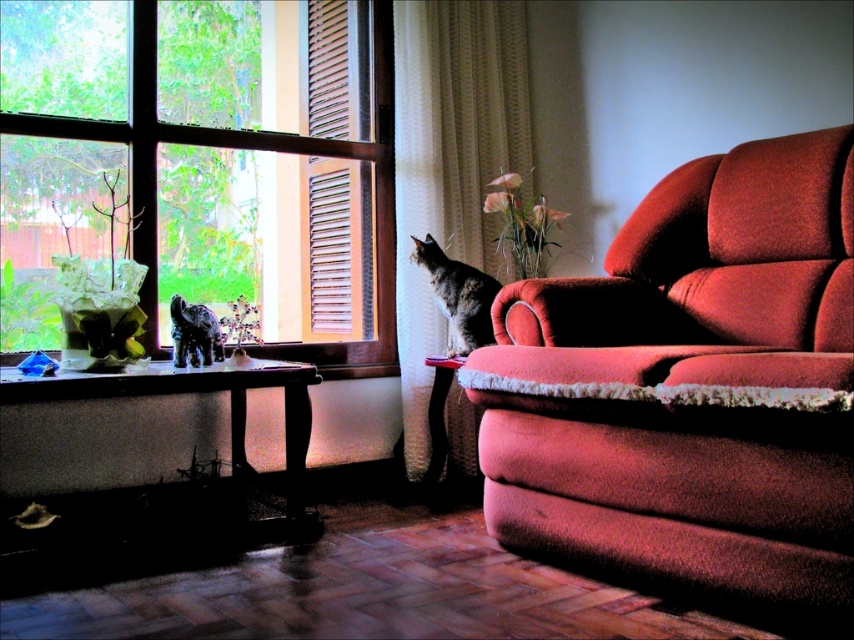
Question: From the image, what is the correct spatial relationship of velvet red couch at right in relation to wooden table at lower left?

Choices:
 (A) below
 (B) above

Answer: (B)

Question: Which point is closer to the camera?

Choices:
 (A) (291, 492)
 (B) (600, 408)
 (C) (430, 282)

Answer: (B)

Question: Which object is farther from the camera taking this photo?

Choices:
 (A) velvet red couch at right
 (B) wooden table at lower left

Answer: (B)

Question: Among these points, which one is nearest to the camera?

Choices:
 (A) (144, 387)
 (B) (314, 138)

Answer: (A)

Question: Is velvet red couch at right in front of wooden table at lower left?

Choices:
 (A) yes
 (B) no

Answer: (A)

Question: Is wooden table at lower left to the right of tabby fur cat at center from the viewer's perspective?

Choices:
 (A) yes
 (B) no

Answer: (B)